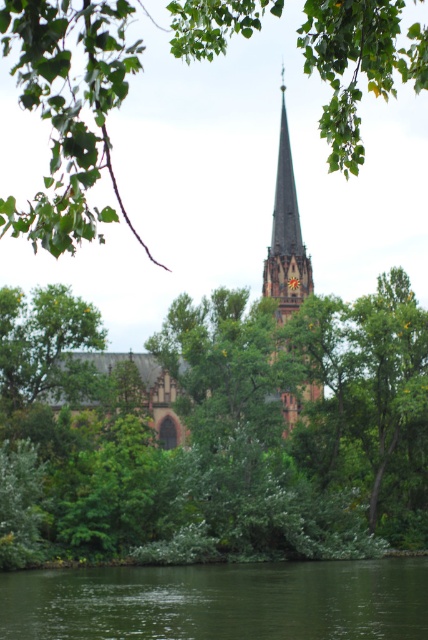
Is green leafy tree at center wider than green leafy tree at upper center?

Incorrect, green leafy tree at center's width does not surpass green leafy tree at upper center's.

What are the coordinates of `green leafy tree at center` in the screenshot? It's located at (220, 429).

Where is `green leafy tree at center`? green leafy tree at center is located at coordinates (220, 429).

Can you confirm if green leafy tree at center is bigger than brown stone church at center?

No.

Can you confirm if green leafy tree at center is positioned to the left of brown stone church at center?

Correct, you'll find green leafy tree at center to the left of brown stone church at center.

Image resolution: width=428 pixels, height=640 pixels. Find the location of `green leafy tree at center`. green leafy tree at center is located at coordinates (220, 429).

The image size is (428, 640). Identify the location of green leafy tree at center. (220, 429).

Is green smooth water at lower center in front of dark brown stone spire at center?

Yes, green smooth water at lower center is in front of dark brown stone spire at center.

Between green smooth water at lower center and dark brown stone spire at center, which one is positioned lower?

Positioned lower is green smooth water at lower center.

I want to click on green smooth water at lower center, so click(219, 602).

Where is `green smooth water at lower center`? The image size is (428, 640). green smooth water at lower center is located at coordinates (219, 602).